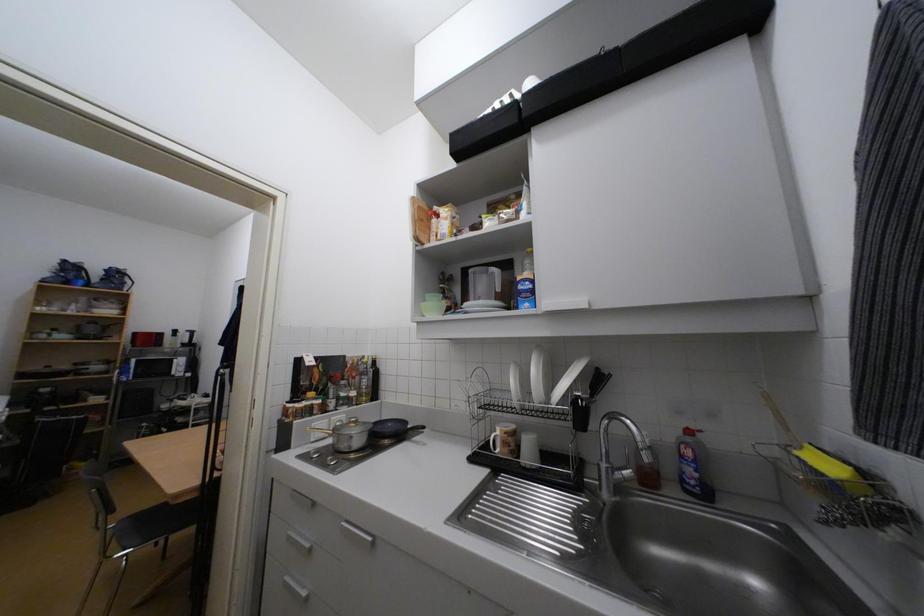
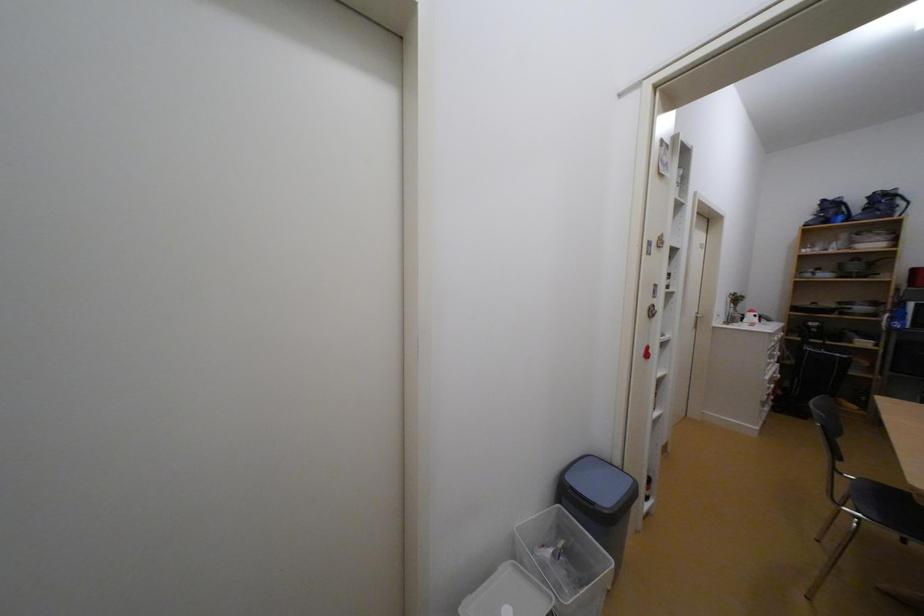
Question: The images are taken continuously from a first-person perspective. In which direction is your viewpoint rotating?

Choices:
 (A) Left
 (B) Right
 (C) Up
 (D) Down

Answer: (A)